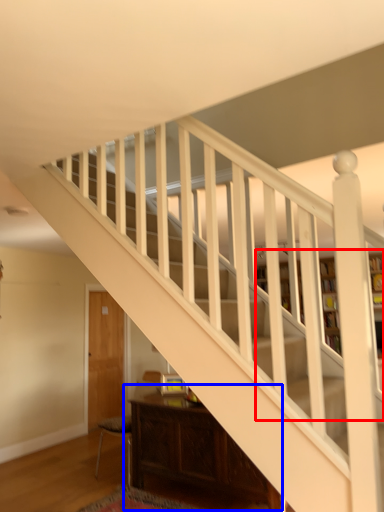
Question: Which object is closer to the camera taking this photo, bookcase (highlighted by a red box) or table (highlighted by a blue box)?

Choices:
 (A) bookcase
 (B) table

Answer: (B)